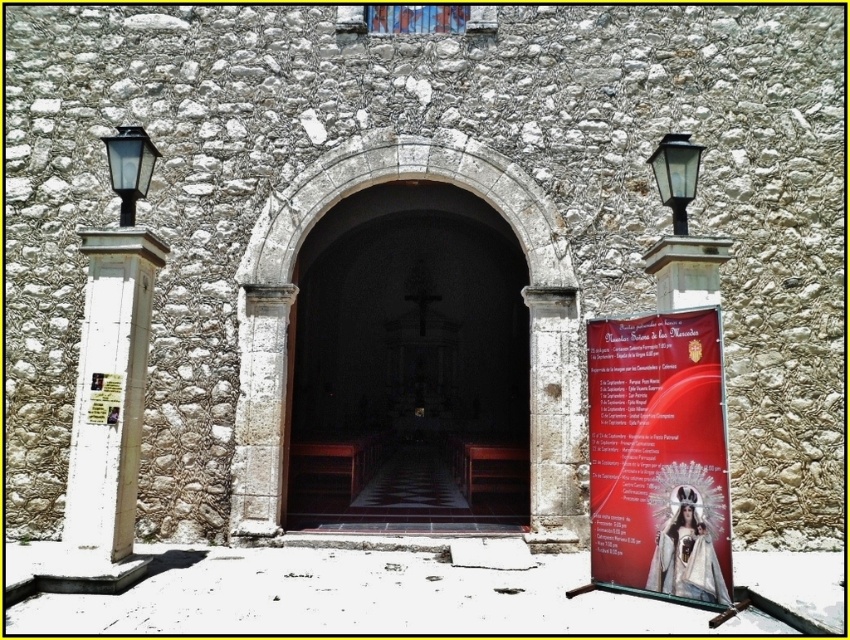
You are a visitor at the church entrance and want to take a photo of the dark wood door at center and the red glossy poster at right. Which object should you focus on first if you want to capture both in one frame without moving your camera?

The dark wood door at center is taller than the red glossy poster at right, so you should focus on the dark wood door at center first to ensure it fits within the frame before adjusting for the smaller poster.

You are a delivery person trying to deliver a package to the church office located behind the dark wood door at center. The package is too large to fit through the doorway. Can you determine if the black glass lamp at upper right is smaller than the door?

The dark wood door at center is bigger than the black glass lamp at upper right, so the black glass lamp at upper right is smaller than the door. Therefore, the package cannot pass through the doorway, but the size of the lamp does not affect the package delivery.